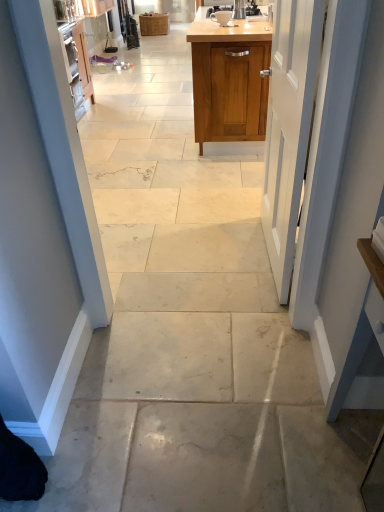
Question: Should I look upward or downward to see wooden cabinet at center, the second cabinetry in the bottom-to-top sequence?

Choices:
 (A) down
 (B) up

Answer: (B)

Question: Is the depth of wooden cabinet at center, which is counted as the 2th cabinetry, starting from the front, less than that of wooden cabinet at upper center, the first cabinetry positioned from the bottom?

Choices:
 (A) yes
 (B) no

Answer: (B)

Question: Considering the relative sizes of wooden cabinet at center, which is counted as the 2th cabinetry, starting from the front, and wooden cabinet at upper center, the first cabinetry positioned from the bottom, in the image provided, is wooden cabinet at center, which is counted as the 2th cabinetry, starting from the front, wider than wooden cabinet at upper center, the first cabinetry positioned from the bottom,?

Choices:
 (A) yes
 (B) no

Answer: (B)

Question: Is wooden cabinet at center, the first cabinetry when ordered from back to front, facing towards wooden cabinet at upper center, the 2th cabinetry viewed from the left?

Choices:
 (A) no
 (B) yes

Answer: (A)

Question: From a real-world perspective, does wooden cabinet at center, the first cabinetry when ordered from back to front, stand above wooden cabinet at upper center, acting as the first cabinetry starting from the front?

Choices:
 (A) no
 (B) yes

Answer: (A)

Question: Can you confirm if wooden cabinet at center, positioned as the 2th cabinetry in right-to-left order, is shorter than wooden cabinet at upper center, the second cabinetry when ordered from top to bottom?

Choices:
 (A) yes
 (B) no

Answer: (A)

Question: Is wooden cabinet at center, which is counted as the 2th cabinetry, starting from the front, next to wooden cabinet at upper center, acting as the first cabinetry starting from the front, and touching it?

Choices:
 (A) no
 (B) yes

Answer: (A)

Question: Does wooden cabinet at center, positioned as the 2th cabinetry in right-to-left order, lie behind white painted wood door at center?

Choices:
 (A) no
 (B) yes

Answer: (B)

Question: Can you confirm if wooden cabinet at center, positioned as the 2th cabinetry in right-to-left order, is thinner than white painted wood door at center?

Choices:
 (A) no
 (B) yes

Answer: (A)

Question: Does wooden cabinet at center, placed as the 1th cabinetry when sorted from top to bottom, touch white painted wood door at center?

Choices:
 (A) yes
 (B) no

Answer: (B)

Question: Is wooden cabinet at center, positioned as the first cabinetry in left-to-right order, to the left of white painted wood door at center from the viewer's perspective?

Choices:
 (A) no
 (B) yes

Answer: (B)

Question: Is white painted wood door at center surrounded by wooden cabinet at center, placed as the 1th cabinetry when sorted from top to bottom?

Choices:
 (A) no
 (B) yes

Answer: (A)

Question: From a real-world perspective, does wooden cabinet at center, the second cabinetry in the bottom-to-top sequence, stand above white painted wood door at center?

Choices:
 (A) no
 (B) yes

Answer: (A)

Question: From the image's perspective, is wooden cabinet at upper center, which is counted as the 2th cabinetry, starting from the back, below wooden cabinet at center, the second cabinetry in the bottom-to-top sequence?

Choices:
 (A) yes
 (B) no

Answer: (A)